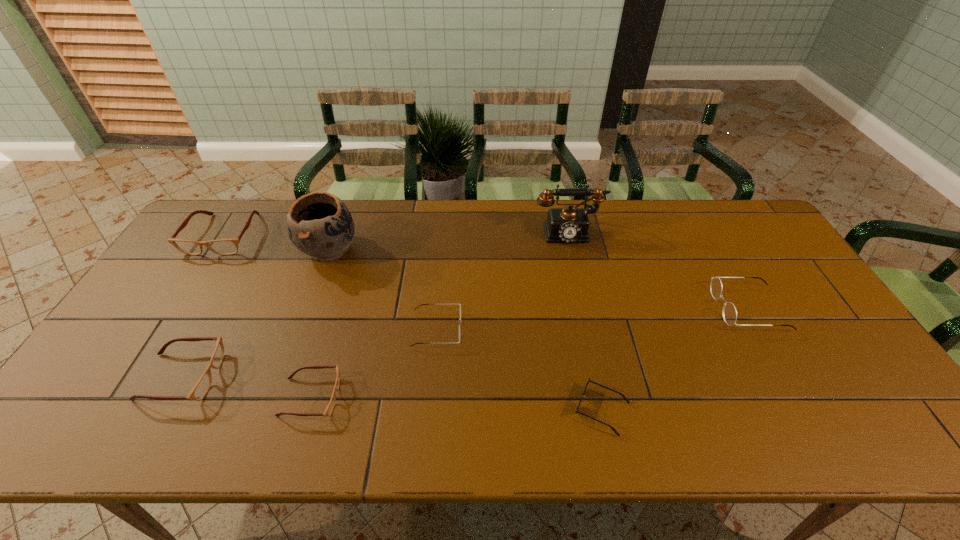
Locate which spectacles ranks second in proximity to the gray telephone. Please provide its 2D coordinates. Your answer should be formatted as a tuple, i.e. [(x, y)], where the tuple contains the x and y coordinates of a point satisfying the conditions above.

[(422, 304)]

Where is `the third closest brown spectacles to the telephone`? The image size is (960, 540). the third closest brown spectacles to the telephone is located at coordinates [223, 246].

In order to click on brown spectacles that is the second closest to the second spectacles from right to left in this screenshot , I will do `click(198, 392)`.

Find the location of a particular element. free space in the image that satisfies the following two spatial constraints: 1. on the front of the telephone at the rotary dial; 2. on the front-facing side of the rightmost brown spectacles is located at coordinates (605, 397).

This screenshot has height=540, width=960. In order to click on free space in the image that satisfies the following two spatial constraints: 1. on the front of the telephone at the rotary dial; 2. on the front-facing side of the smaller black spectacles in this screenshot , I will do `click(589, 329)`.

Identify the location of free spot that satisfies the following two spatial constraints: 1. on the front-facing side of the pottery; 2. on the left side of the biggest brown spectacles. (214, 249).